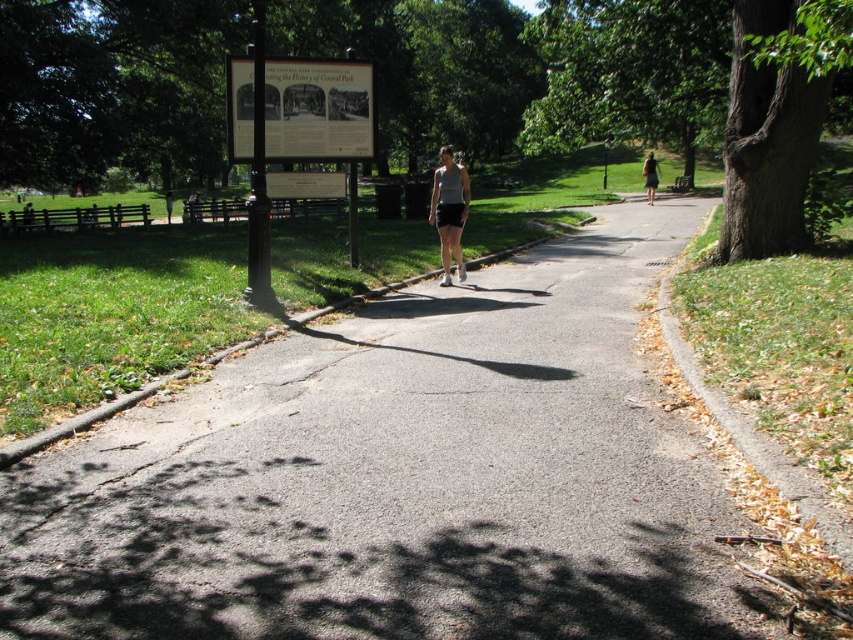
You are a park visitor wanting to walk along the asphalt path at center. However, there is a dark green skirt at right nearby. Based on the scene description, can you determine if the skirt is on the path or beside it?

The asphalt path at center is positioned under dark green skirt at right, meaning the skirt is likely on the path, so the skirt is on the path.

You are a gardener who needs to water the green rough bark tree at right. You are currently standing on the asphalt path at center. What is the shortest distance you need to walk to reach the tree?

The shortest distance you need to walk to reach the green rough bark tree at right from the asphalt path at center is 4.05 meters, as they are 4.05 meters apart from each other.

You are a park visitor standing at the entrance and want to reach the green rough bark tree at right. Which direction should you walk relative to the asphalt path at center?

The asphalt path at center is to the left of the green rough bark tree at right, so you should walk to the right of the asphalt path at center to reach the tree.